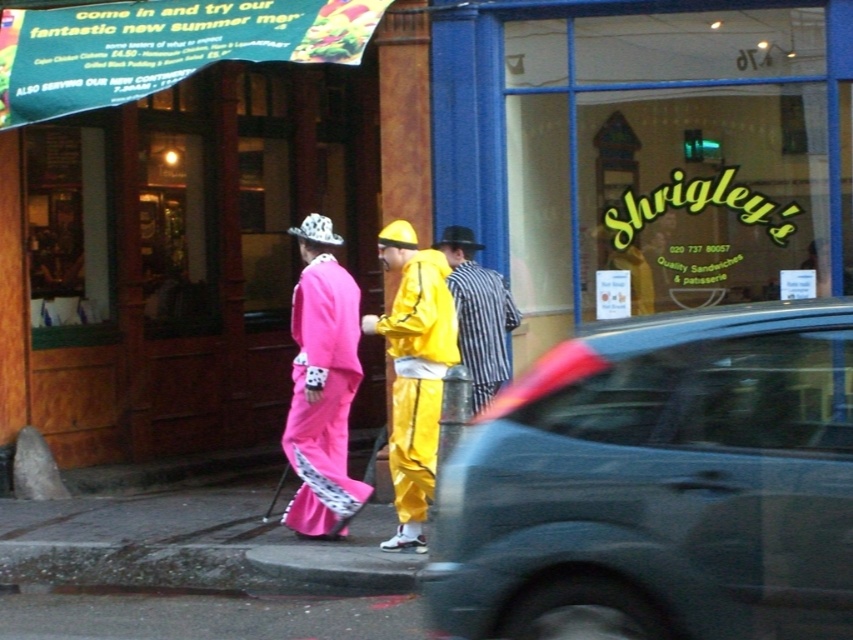
You are standing at the entrance of Shrigley shop and see two people walking in front of you. One is wearing a matte yellow jumpsuit at center and the other is wearing a striped fabric shirt at center. Which person is closer to you?

The matte yellow jumpsuit at center is closer to you because it is in front of the striped fabric shirt at center.

You are a pedestrian standing on the sidewalk near Shrigley shop. You see a metallic gray car at center and a matte yellow jumpsuit at center. Which object is closer to you?

The matte yellow jumpsuit at center is closer to you because the metallic gray car at center is positioned under it, meaning the jumpsuit is above the car in the scene.

You are standing at the point labeled point (x=305, y=228) and want to walk to the point labeled point (x=660, y=612). Which direction should you face to move towards your destination?

You should face forward because point (x=660, y=612) is in front of point (x=305, y=228).